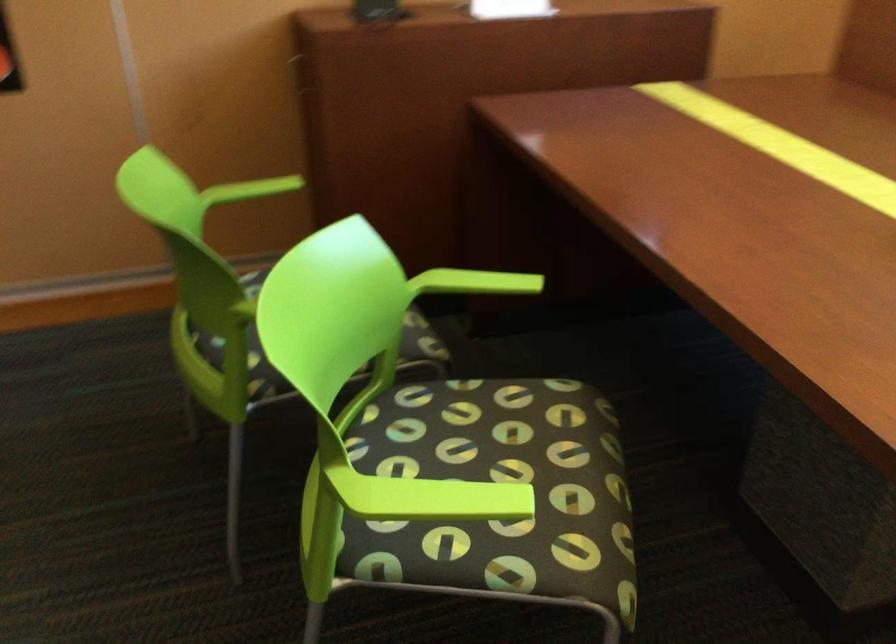
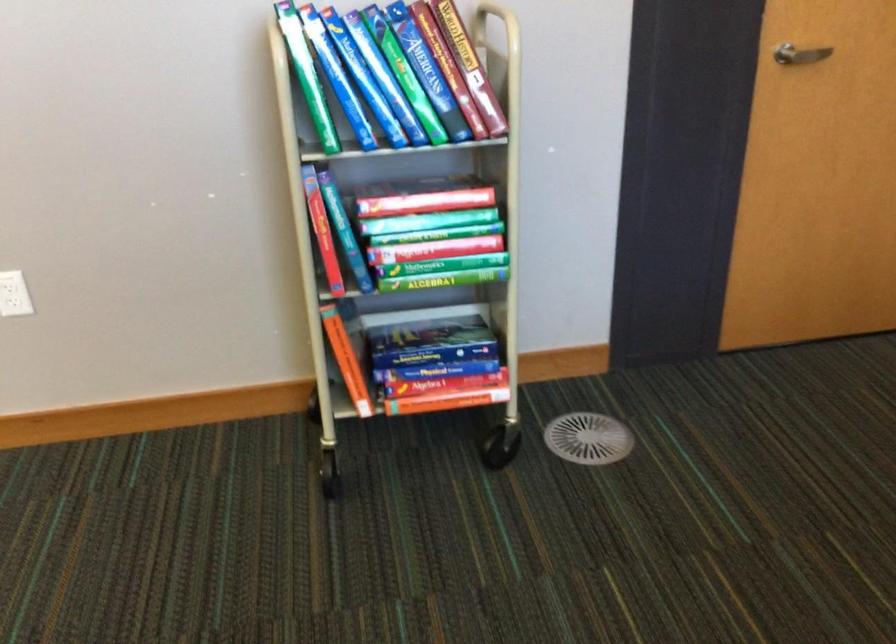
First-person continuous shooting, in which direction is the camera rotating?

The rotation direction of the camera is left-down.